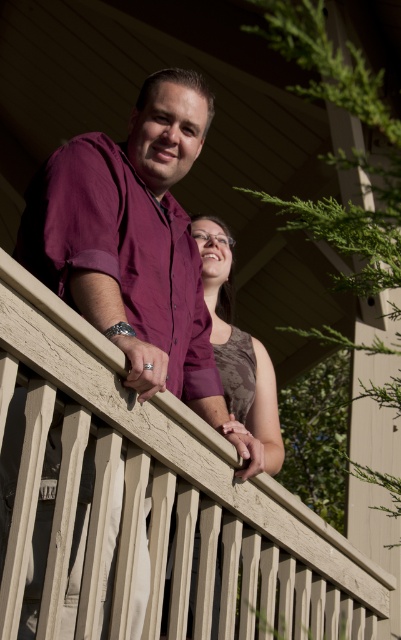
You are standing at the center of the wooden deck and want to lean against the beige textured railing at upper center. Given that the railing is located at coordinates point 0.783, 0.401, how far to your right or left should you move to reach it?

The beige textured railing at upper center is located at point (160, 500), so you should move to your right to reach it since the x coordinate 0.783 is to the right of the center point 0.5.

You are a photographer trying to capture the scene where the beige textured railing at upper center and the brown textured dress at center are visible. Based on their positions, which object should appear higher in the photo?

The brown textured dress at center appears higher than the beige textured railing at upper center in the photo because the beige textured railing at upper center is below the brown textured dress at center.

Based on the photo, you are standing on the wooden deck and want to place a small potted plant exactly at point (160, 500). According to the scene description, what object will the plant be placed on?

The beige textured railing at upper center is located at point (160, 500), so the plant will be placed on the beige textured railing at upper center.